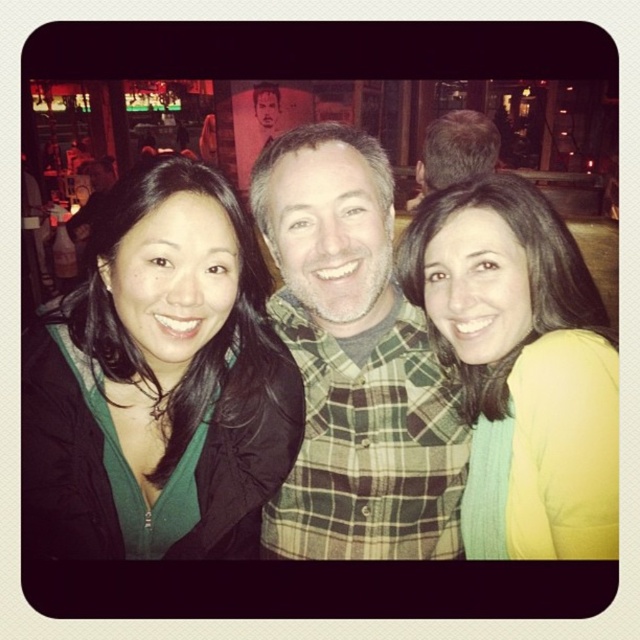
You are standing in the same room and want to take a photo of both the green matte jacket at left and the yellow matte sweater at center. Which direction should you face to ensure both are in your camera frame?

You should face towards the center of the two individuals since the green matte jacket at left is to the left of the yellow matte sweater at center, ensuring both are within the camera frame when facing the center.

You are taking a photo of two points in a room. The first point is at coordinates point (240,369) and the second is at point (284,278). If you want to focus on the closer point to the camera, which coordinate should you adjust your camera to focus on?

The point at coordinates point (240,369) is closer to the camera than point (284,278), so you should focus on point (240,369).

From the picture: You are a photographer trying to adjust the lighting for a group photo. You notice the green matte jacket at left and the green plaid shirt at center. Which of these two items is closer to the camera?

The green plaid shirt at center is closer to the camera because the green matte jacket at left is positioned under it.